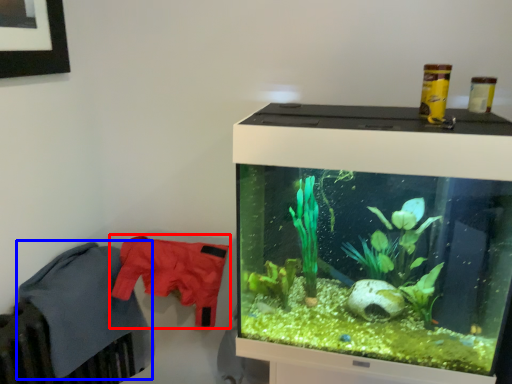
Question: Which object is further to the camera taking this photo, clothing (highlighted by a red box) or clothing (highlighted by a blue box)?

Choices:
 (A) clothing
 (B) clothing

Answer: (A)